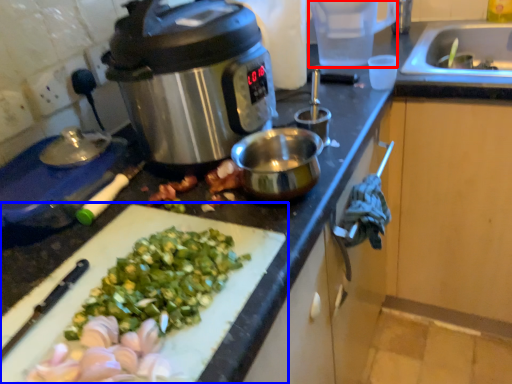
Question: Which object appears closest to the camera in this image, appliance (highlighted by a red box) or cutting board (highlighted by a blue box)?

Choices:
 (A) appliance
 (B) cutting board

Answer: (B)